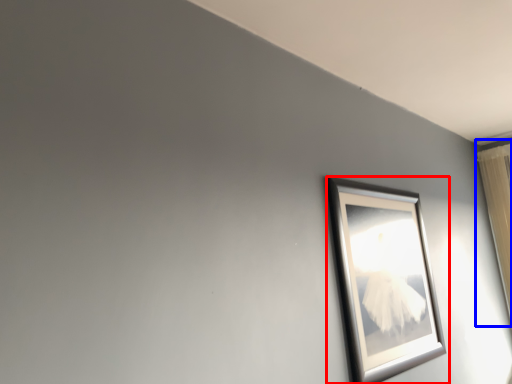
Question: Which point is further to the camera, picture frame (highlighted by a red box) or curtain (highlighted by a blue box)?

Choices:
 (A) picture frame
 (B) curtain

Answer: (B)